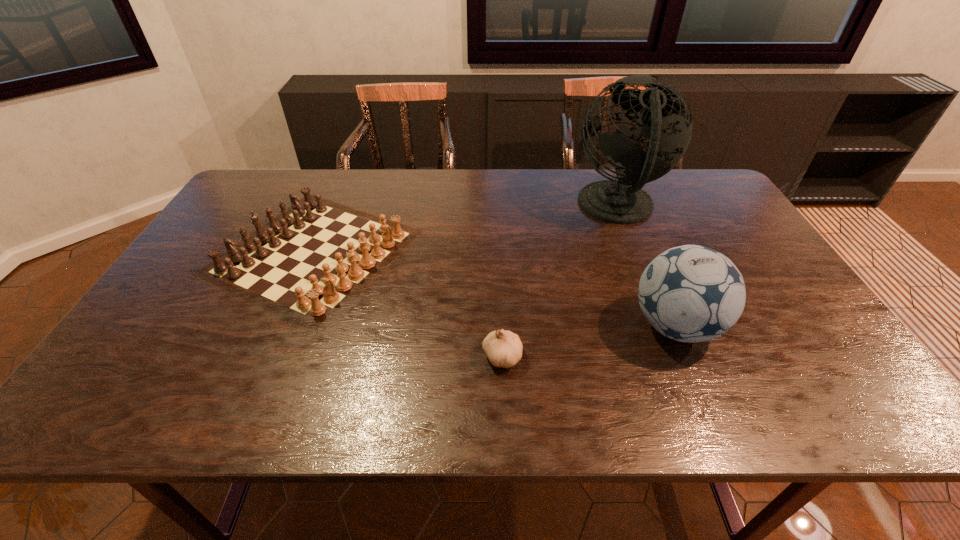
The height and width of the screenshot is (540, 960). In order to click on empty space between the third object from right to left and the leftmost object in this screenshot , I will do `click(408, 304)`.

At what (x,y) coordinates should I click in order to perform the action: click on unoccupied position between the second tallest object and the garlic. Please return your answer as a coordinate pair (x, y). The image size is (960, 540). Looking at the image, I should click on (588, 341).

Where is `vacant area between the chessboard and the shortest object`? Image resolution: width=960 pixels, height=540 pixels. vacant area between the chessboard and the shortest object is located at coordinates (408, 304).

The height and width of the screenshot is (540, 960). I want to click on the closest object to the third object from right to left, so click(x=309, y=261).

This screenshot has width=960, height=540. Find the location of `object that can be found as the closest to the leftmost object`. object that can be found as the closest to the leftmost object is located at coordinates (503, 348).

Locate an element on the screen. free spot that satisfies the following two spatial constraints: 1. on the front-facing side of the globe; 2. on the front side of the shortest object is located at coordinates (677, 356).

Locate an element on the screen. The width and height of the screenshot is (960, 540). free point that satisfies the following two spatial constraints: 1. on the front-facing side of the tallest object; 2. on the front side of the third tallest object is located at coordinates (635, 252).